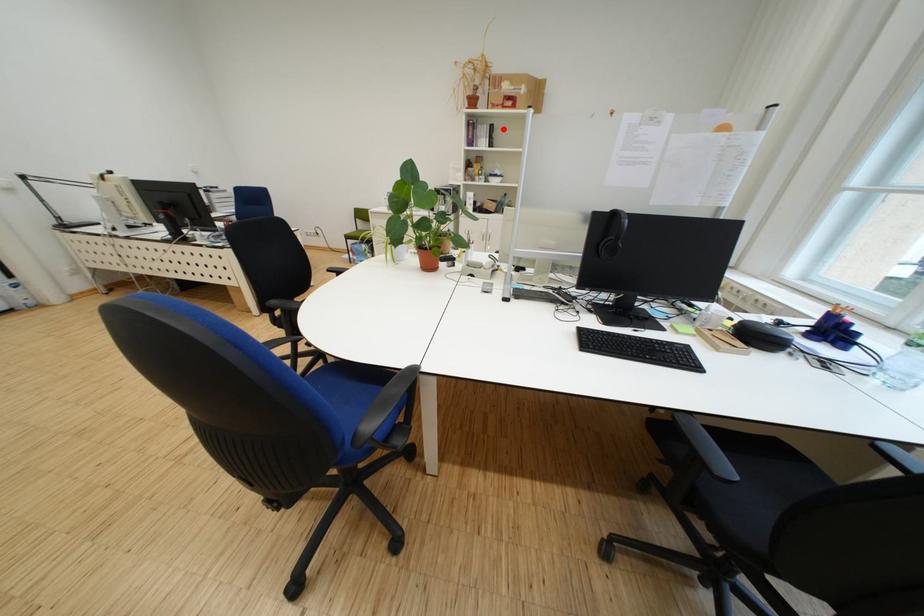
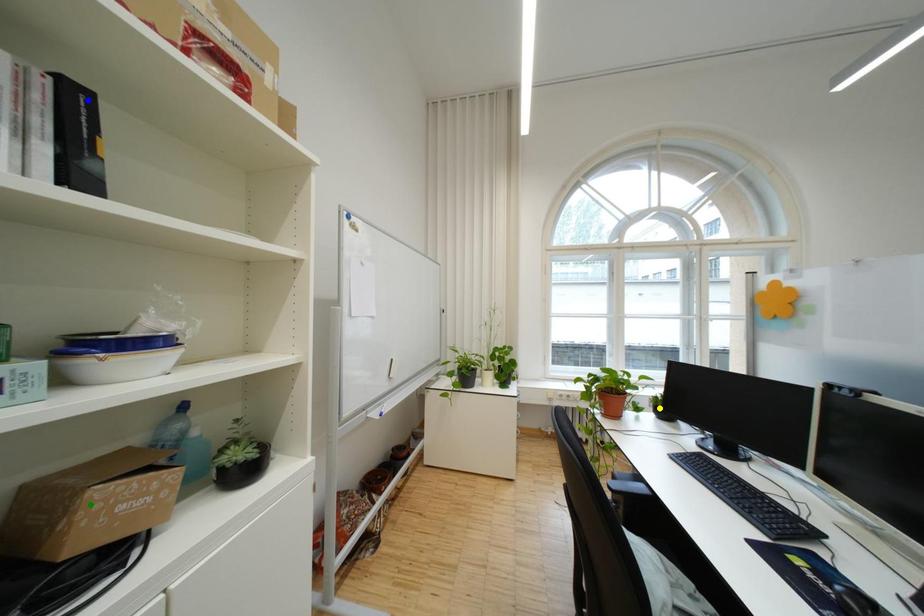
Question: I am providing you with two images of the same scene from different viewpoints. A red point is marked on the first image. You are given multiple points on the second image. Which point in image 2 is actually the same real-world point as the red point in image 1?

Choices:
 (A) yellow point
 (B) blue point
 (C) green point

Answer: (B)